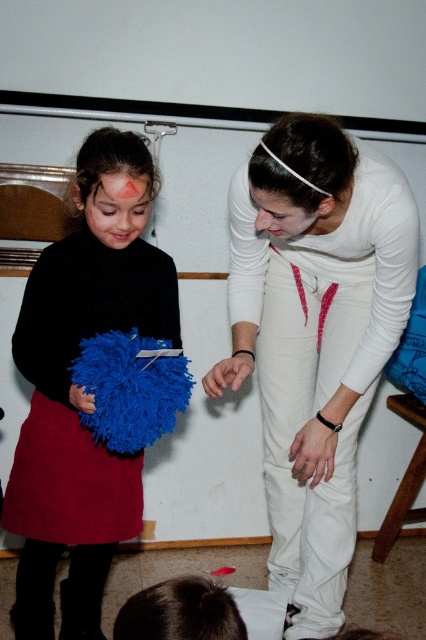
Is point (291, 353) farther from viewer compared to point (103, 426)?

Yes, point (291, 353) is behind point (103, 426).

Between white matte pants at center and fuzzy blue heart at lower left, which one has more height?

white matte pants at center is taller.

Does point (299, 515) come behind point (155, 369)?

Yes.

You are a GUI agent. You are given a task and a screenshot of the screen. Output one action in this format:
    pyautogui.click(x=<x>, y=<y>)
    Task: Click on the white matte pants at center
    The image size is (426, 640).
    Given the screenshot: What is the action you would take?
    point(314,337)

Is white matte pants at center positioned at the back of velvety blue pom-pom at left?

That is False.

Between white matte pants at center and velvety blue pom-pom at left, which one is positioned higher?

white matte pants at center is higher up.

Measure the distance between white matte pants at center and camera.

1.20 meters

This screenshot has height=640, width=426. Identify the location of white matte pants at center. pos(314,337).

Can you confirm if velvety blue pom-pom at left is positioned above fuzzy blue heart at lower left?

Actually, velvety blue pom-pom at left is below fuzzy blue heart at lower left.

Which of these two, velvety blue pom-pom at left or fuzzy blue heart at lower left, stands shorter?

With less height is fuzzy blue heart at lower left.

Measure the distance between point (91,579) and camera.

Point (91,579) is 5.47 feet away from camera.

Identify the location of velvety blue pom-pom at left. This screenshot has width=426, height=640. (81, 387).